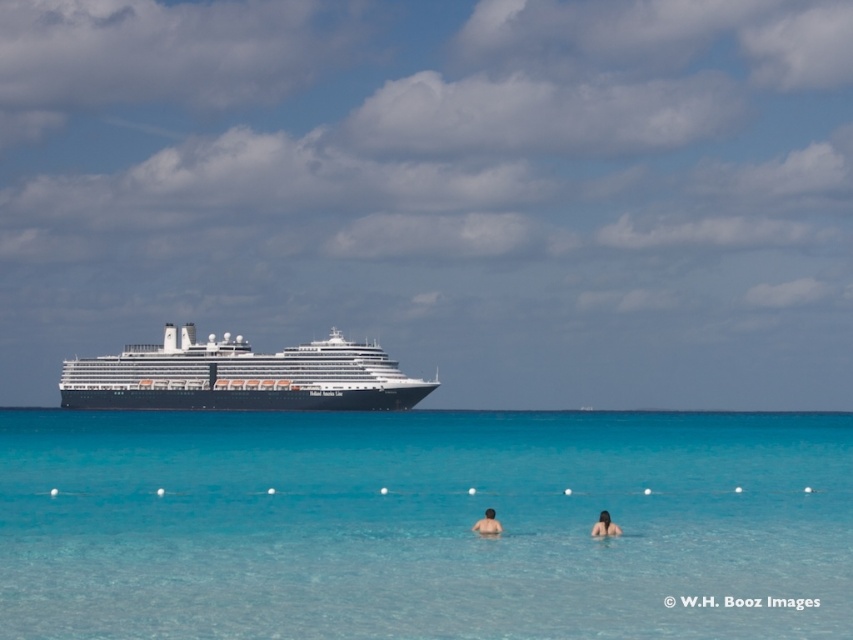
Question: Among these points, which one is farthest from the camera?

Choices:
 (A) (494, 529)
 (B) (357, 355)

Answer: (B)

Question: Among these points, which one is nearest to the camera?

Choices:
 (A) (564, 432)
 (B) (335, 396)
 (C) (601, 529)

Answer: (C)

Question: Is black glossy cruise ship at center below skinny man at center?

Choices:
 (A) no
 (B) yes

Answer: (A)

Question: Where is black glossy cruise ship at center located in relation to skinny man at center in the image?

Choices:
 (A) left
 (B) right

Answer: (A)

Question: Is clear blue water at center below skinny man at center?

Choices:
 (A) no
 (B) yes

Answer: (B)

Question: Considering the real-world distances, which object is farthest from the black glossy cruise ship at center?

Choices:
 (A) clear blue water at center
 (B) skinny man at center

Answer: (B)